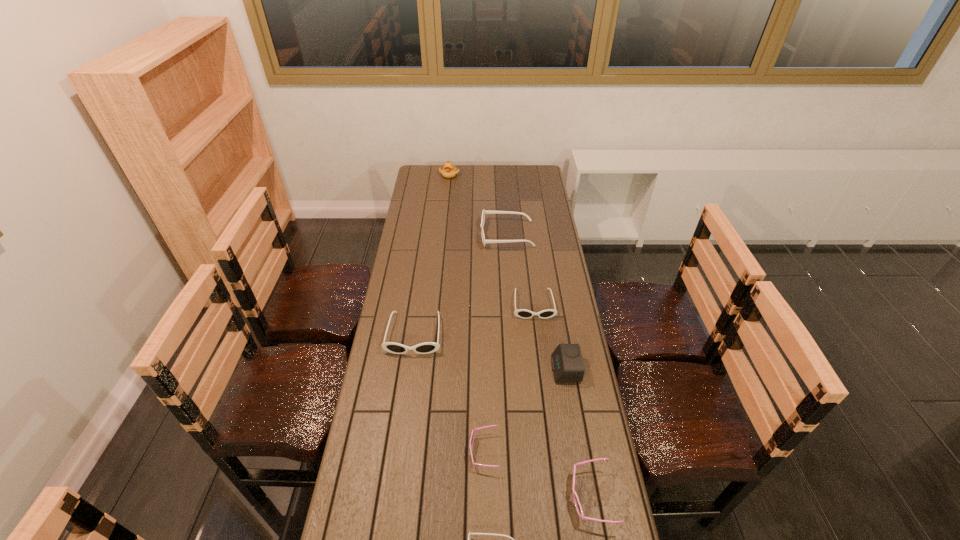
Locate an element on the screen. free space at the far edge of the desktop is located at coordinates (507, 184).

Locate an element on the screen. This screenshot has height=540, width=960. free spot at the left edge of the desktop is located at coordinates (416, 332).

Where is `vacant space at the right edge`? The width and height of the screenshot is (960, 540). vacant space at the right edge is located at coordinates (535, 196).

Identify the location of free point between the third biggest black sunglasses and the alarm clock. (549, 337).

The width and height of the screenshot is (960, 540). Identify the location of vacant space in between the second smallest black sunglasses and the smaller pink sunglasses. pos(509,378).

Locate an element on the screen. vacant area that lies between the leftmost black sunglasses and the smaller pink sunglasses is located at coordinates (449, 393).

Locate an element on the screen. free spot between the bigger pink sunglasses and the farthest object is located at coordinates point(520,336).

The height and width of the screenshot is (540, 960). In order to click on vacant region between the farthest sunglasses and the left pink sunglasses in this screenshot , I will do `click(495, 343)`.

You are a GUI agent. You are given a task and a screenshot of the screen. Output one action in this format:
    pyautogui.click(x=<x>, y=<y>)
    Task: Click on the vacant area that lies between the farthest sunglasses and the left pink sunglasses
    
    Given the screenshot: What is the action you would take?
    pyautogui.click(x=495, y=343)

This screenshot has width=960, height=540. Find the location of `free point between the right pink sunglasses and the third biggest black sunglasses`. free point between the right pink sunglasses and the third biggest black sunglasses is located at coordinates (563, 401).